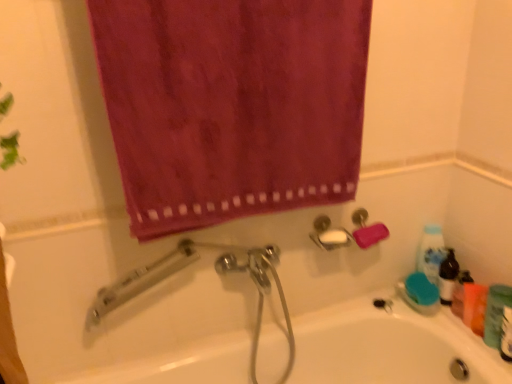
Question: From the image's perspective, is velvet-like magenta towel at upper center above or below green matte bottle at lower right?

Choices:
 (A) below
 (B) above

Answer: (B)

Question: Does point (90, 11) appear closer or farther from the camera than point (492, 342)?

Choices:
 (A) closer
 (B) farther

Answer: (A)

Question: Which of these objects is positioned closest to the orange matte bottle at right, the first mouthwash from the back?

Choices:
 (A) green matte bottle at lower right
 (B) blue glossy bottle at right
 (C) velvet-like magenta towel at upper center
 (D) green plastic mouthwash at lower right, which is counted as the first mouthwash, starting from the right
 (E) white glossy bathtub at center

Answer: (A)

Question: Which object is the closest to the white glossy bathtub at center?

Choices:
 (A) green plastic mouthwash at lower right, the 1th mouthwash from the front
 (B) green matte bottle at lower right
 (C) velvet-like magenta towel at upper center
 (D) blue glossy bottle at right
 (E) orange matte bottle at right, marked as the first mouthwash in a left-to-right arrangement

Answer: (E)